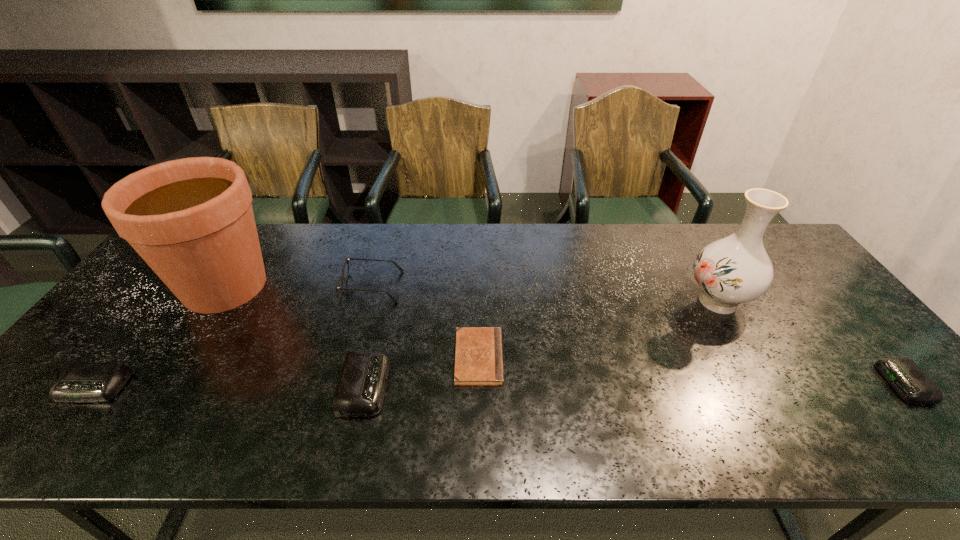
Locate an element on the screen. Image resolution: width=960 pixels, height=540 pixels. alarm clock that is at the left edge is located at coordinates (80, 382).

What are the coordinates of `flowerpot that is at the left edge` in the screenshot? It's located at (191, 220).

Locate an element on the screen. Image resolution: width=960 pixels, height=540 pixels. object situated at the right edge is located at coordinates (903, 374).

Identify the location of object at the far left corner. (191, 220).

Where is `object present at the near left corner`? The image size is (960, 540). object present at the near left corner is located at coordinates (80, 382).

At what (x,y) coordinates should I click in order to perform the action: click on object that is at the near right corner. Please return your answer as a coordinate pair (x, y). The image size is (960, 540). Looking at the image, I should click on (903, 374).

This screenshot has height=540, width=960. What are the coordinates of `free space at the far edge` in the screenshot? It's located at (673, 233).

In the image, there is a desktop. Where is `free space at the near edge`? free space at the near edge is located at coordinates (496, 411).

This screenshot has height=540, width=960. I want to click on vacant space at the left edge, so click(x=146, y=334).

You are a GUI agent. You are given a task and a screenshot of the screen. Output one action in this format:
    pyautogui.click(x=<x>, y=<y>)
    Task: Click on the free spot at the right edge of the desktop
    The image size is (960, 540).
    Given the screenshot: What is the action you would take?
    pyautogui.click(x=805, y=342)